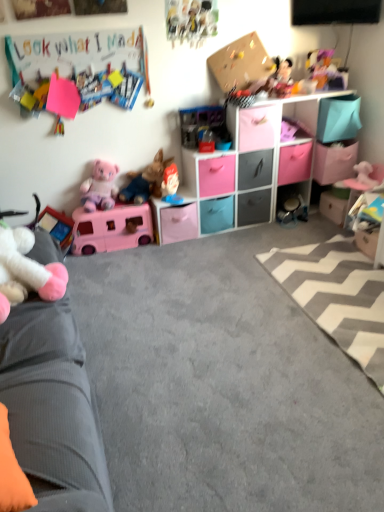
Question: Does cartoonish paper poster at upper center, which is counted as the sixth toy, starting from the left, have a smaller size compared to white plush toy at left, which is the ninth toy in right-to-left order?

Choices:
 (A) yes
 (B) no

Answer: (A)

Question: Is cartoonish paper poster at upper center, which is counted as the sixth toy, starting from the left, aimed at white plush toy at left, the first toy positioned from the left?

Choices:
 (A) no
 (B) yes

Answer: (A)

Question: From the image's perspective, is cartoonish paper poster at upper center, which is counted as the sixth toy, starting from the left, on white plush toy at left, which is the ninth toy in right-to-left order?

Choices:
 (A) yes
 (B) no

Answer: (A)

Question: Considering the relative positions of cartoonish paper poster at upper center, which is counted as the sixth toy, starting from the left, and white plush toy at left, the first toy positioned from the left, in the image provided, is cartoonish paper poster at upper center, which is counted as the sixth toy, starting from the left, to the right of white plush toy at left, the first toy positioned from the left, from the viewer's perspective?

Choices:
 (A) yes
 (B) no

Answer: (A)

Question: Looking at their shapes, would you say blue matte drawer at center, arranged as the fifth drawer when viewed from the right, is wider or thinner than velvet grey couch at left?

Choices:
 (A) thin
 (B) wide

Answer: (A)

Question: Relative to velvet grey couch at left, is blue matte drawer at center, arranged as the fifth drawer when viewed from the right, in front or behind?

Choices:
 (A) behind
 (B) front

Answer: (A)

Question: From the image's perspective, relative to velvet grey couch at left, is blue matte drawer at center, acting as the third drawer starting from the left, above or below?

Choices:
 (A) above
 (B) below

Answer: (A)

Question: Is blue matte drawer at center, arranged as the fifth drawer when viewed from the right, to the left or to the right of velvet grey couch at left in the image?

Choices:
 (A) left
 (B) right

Answer: (B)

Question: Is plush mickey mouse at upper right, the 8th toy positioned from the left, bigger or smaller than matte pink plastic camper at lower left, the 7th toy viewed from the right?

Choices:
 (A) small
 (B) big

Answer: (A)

Question: Is plush mickey mouse at upper right, which appears as the 2th toy when viewed from the right, inside the boundaries of matte pink plastic camper at lower left, the 7th toy viewed from the right, or outside?

Choices:
 (A) outside
 (B) inside

Answer: (A)

Question: Would you say plush mickey mouse at upper right, which appears as the 2th toy when viewed from the right, is to the left or to the right of matte pink plastic camper at lower left, the 7th toy viewed from the right, in the picture?

Choices:
 (A) left
 (B) right

Answer: (B)

Question: Does point pyautogui.click(x=309, y=52) appear closer or farther from the camera than point pyautogui.click(x=87, y=236)?

Choices:
 (A) closer
 (B) farther

Answer: (B)

Question: Considering the positions of point (379, 342) and point (251, 203), is point (379, 342) closer or farther from the camera than point (251, 203)?

Choices:
 (A) farther
 (B) closer

Answer: (B)

Question: Would you say gray/white zigzag rug at lower right is to the left or to the right of gray matte drawer at center, marked as the sixth drawer in a left-to-right arrangement, in the picture?

Choices:
 (A) left
 (B) right

Answer: (B)